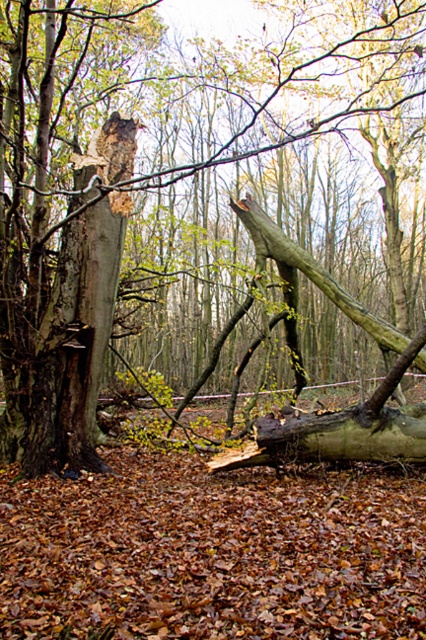
Between smooth bark tree at center and smooth brown tree trunk at left, which one appears on the left side from the viewer's perspective?

Positioned to the left is smooth brown tree trunk at left.

Which is in front, point (224, 76) or point (112, 129)?

Point (112, 129)

I want to click on smooth bark tree at center, so click(147, 189).